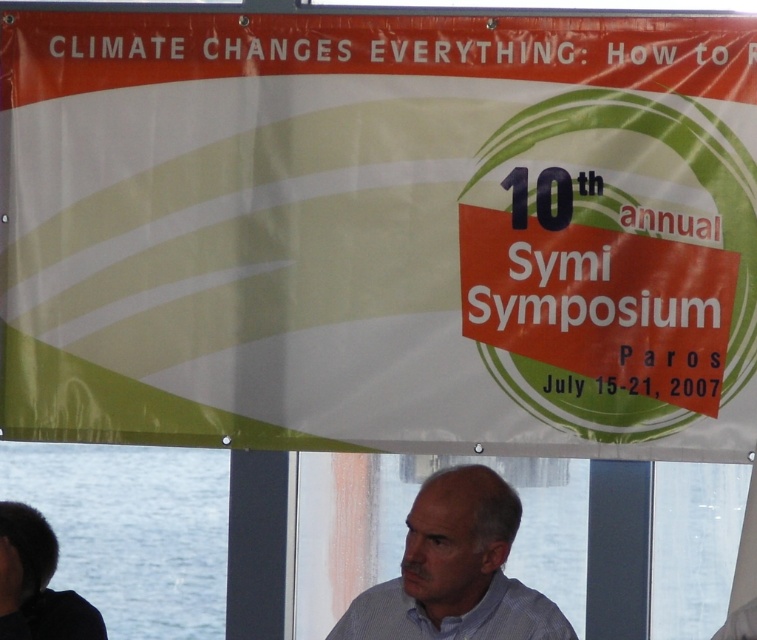
You are standing in the conference room and see the white fabric banner at upper center and the dark brown hair at lower left. Which object is positioned to the right of the other?

The white fabric banner at upper center is to the right of dark brown hair at lower left.

You are attending the 10th annual Symi Symposium and notice two elements in the foreground of the banner image. Which one is wider between the blue water at lower left and the dark brown hair at lower left?

The blue water at lower left is wider than the dark brown hair at lower left according to the description.